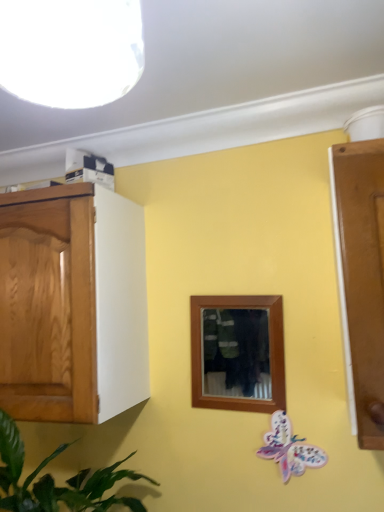
Question: Is green leafy plant at left further to the viewer compared to pastel paper butterfly at lower right?

Choices:
 (A) yes
 (B) no

Answer: (B)

Question: From a real-world perspective, does green leafy plant at left sit lower than pastel paper butterfly at lower right?

Choices:
 (A) no
 (B) yes

Answer: (B)

Question: Is green leafy plant at left facing away from pastel paper butterfly at lower right?

Choices:
 (A) no
 (B) yes

Answer: (A)

Question: Is green leafy plant at left closer to the viewer compared to pastel paper butterfly at lower right?

Choices:
 (A) yes
 (B) no

Answer: (A)

Question: Is green leafy plant at left taller than pastel paper butterfly at lower right?

Choices:
 (A) yes
 (B) no

Answer: (A)

Question: Is green leafy plant at left thinner than pastel paper butterfly at lower right?

Choices:
 (A) no
 (B) yes

Answer: (A)

Question: Does pastel paper butterfly at lower right appear on the right side of green leafy plant at left?

Choices:
 (A) yes
 (B) no

Answer: (A)

Question: Does pastel paper butterfly at lower right come behind green leafy plant at left?

Choices:
 (A) no
 (B) yes

Answer: (B)

Question: Is pastel paper butterfly at lower right thinner than green leafy plant at left?

Choices:
 (A) yes
 (B) no

Answer: (A)

Question: Is pastel paper butterfly at lower right directly adjacent to green leafy plant at left?

Choices:
 (A) yes
 (B) no

Answer: (B)

Question: Considering the relative sizes of pastel paper butterfly at lower right and green leafy plant at left in the image provided, is pastel paper butterfly at lower right wider than green leafy plant at left?

Choices:
 (A) yes
 (B) no

Answer: (B)

Question: Would you say pastel paper butterfly at lower right contains green leafy plant at left?

Choices:
 (A) yes
 (B) no

Answer: (B)

Question: Is the depth of white glossy light fixture at upper left greater than that of green leafy plant at left?

Choices:
 (A) no
 (B) yes

Answer: (A)